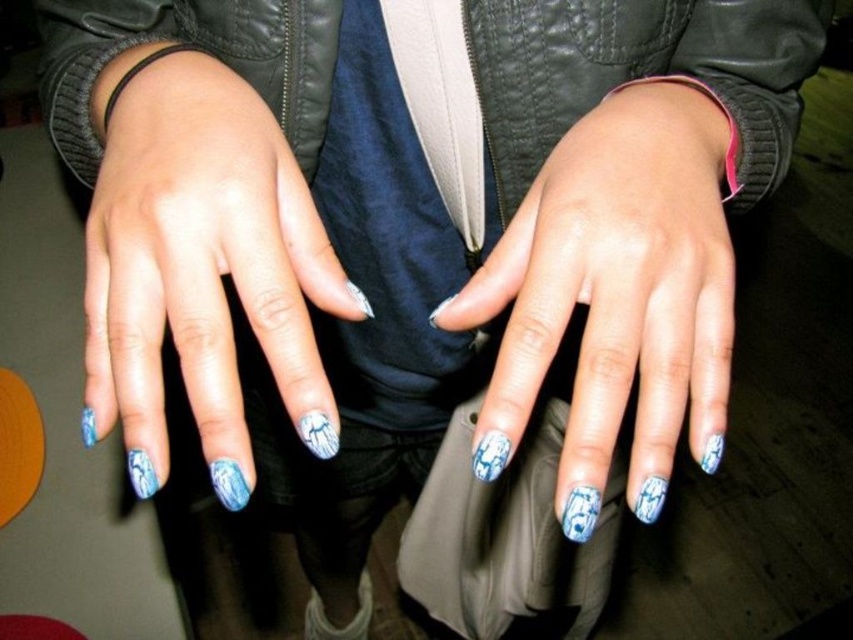
You are a nail technician observing two sets of nails on a client. The client has blue marble nails at center and blue painted nails at center. Which set of nails is bigger?

The blue marble nails at center are larger in size than the blue painted nails at center.

You are a nail technician observing two sets of nails in the image. The blue marble nails at center and the blue painted nails at center. Which set is positioned closer to you?

The blue marble nails at center are closer to the viewer than the blue painted nails at center.